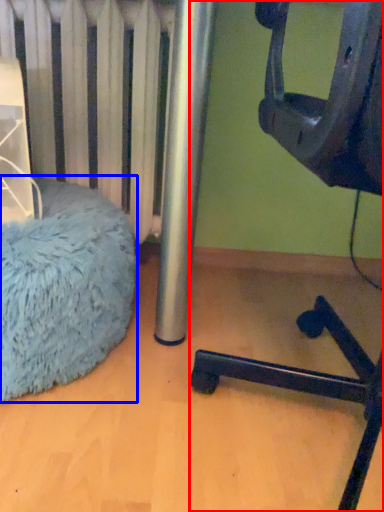
Question: Which object is further to the camera taking this photo, furniture (highlighted by a red box) or bean bag chair (highlighted by a blue box)?

Choices:
 (A) furniture
 (B) bean bag chair

Answer: (B)